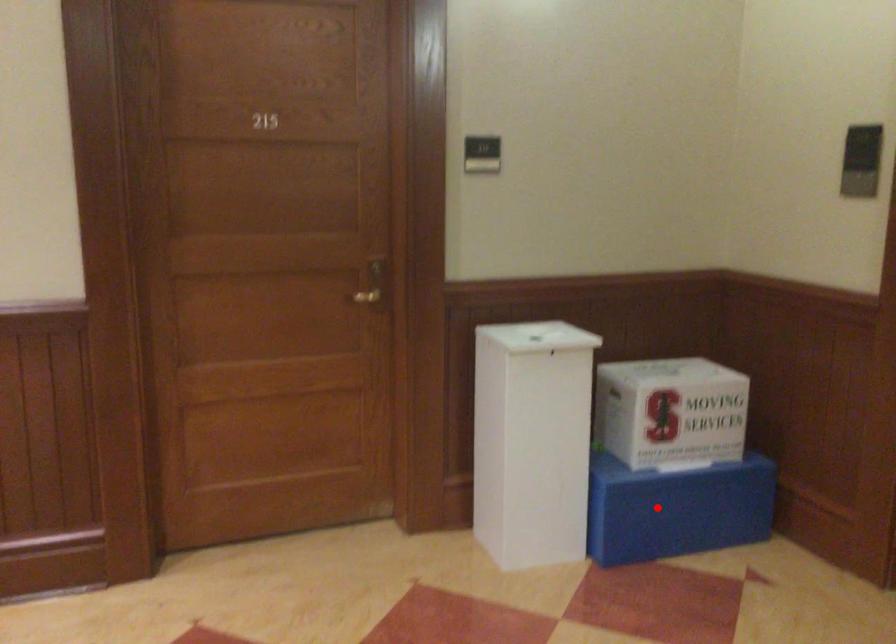
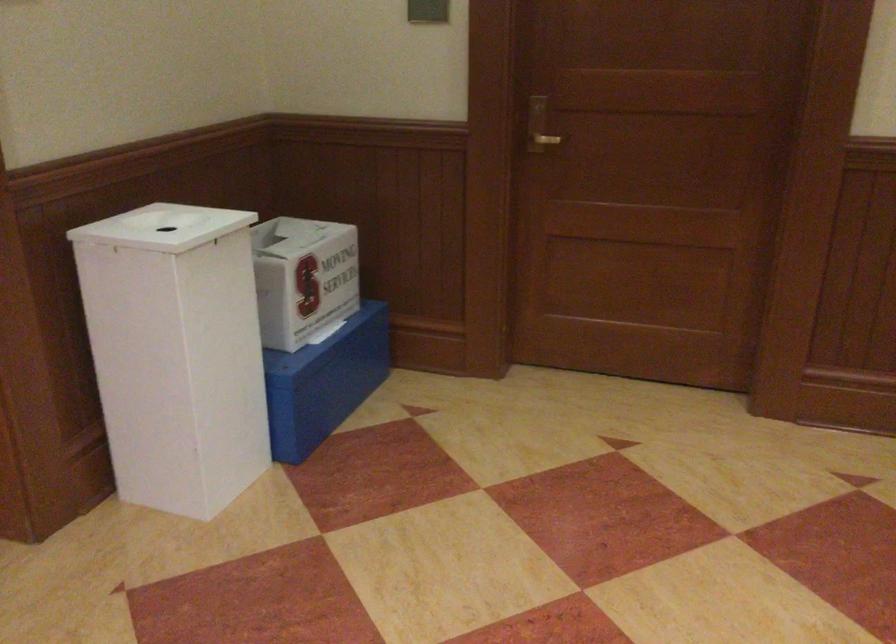
Locate, in the second image, the point that corresponds to the highlighted location in the first image.

(323, 382)